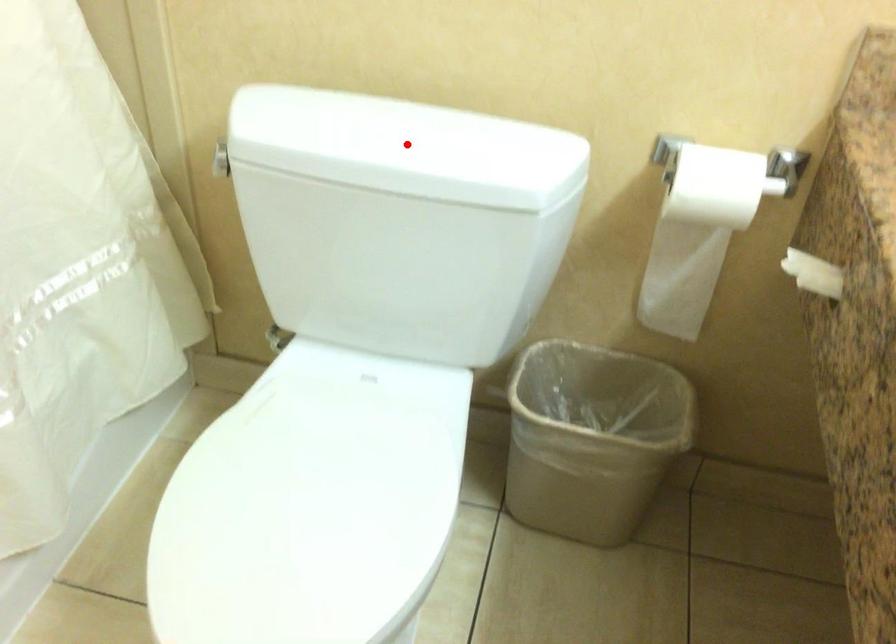
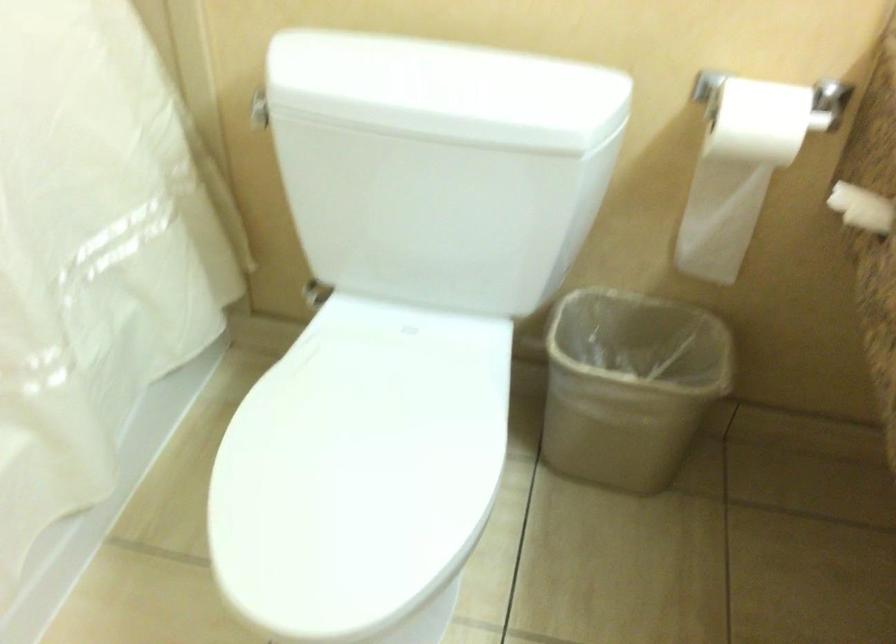
Find the pixel in the second image that matches the highlighted location in the first image.

(446, 90)